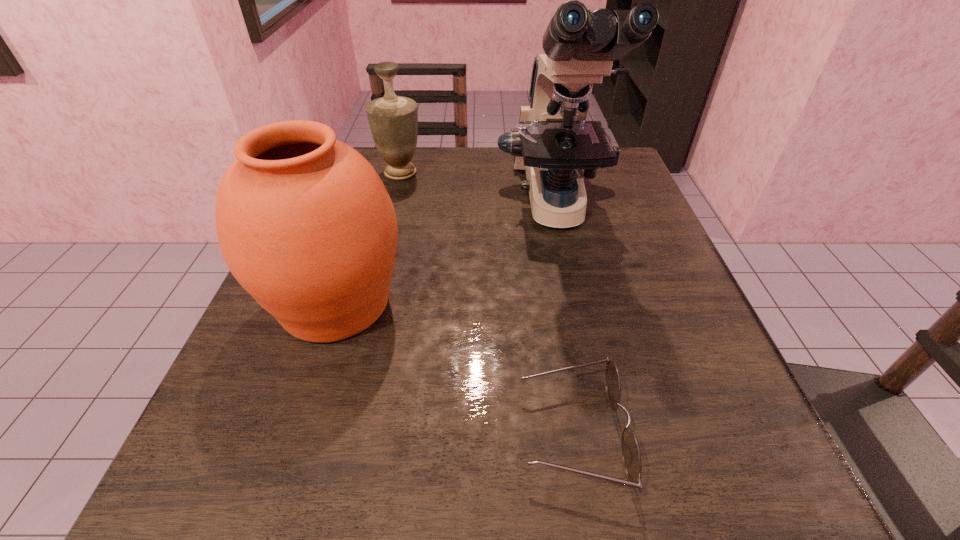
At what (x,y) coordinates should I click in order to perform the action: click on free spot between the shortest object and the farther urn. Please return your answer as a coordinate pair (x, y). The height and width of the screenshot is (540, 960). Looking at the image, I should click on (487, 302).

Where is `free space between the microscope and the second tallest object`? This screenshot has height=540, width=960. free space between the microscope and the second tallest object is located at coordinates (445, 255).

Identify the location of free spot between the microscope and the nearer urn. This screenshot has width=960, height=540. (445, 255).

Locate an element on the screen. unoccupied position between the microscope and the shortest object is located at coordinates (564, 320).

The image size is (960, 540). I want to click on empty location between the spectacles and the taller urn, so click(x=454, y=367).

Point out which object is positioned as the second nearest to the shorter urn. Please provide its 2D coordinates. Your answer should be formatted as a tuple, i.e. [(x, y)], where the tuple contains the x and y coordinates of a point satisfying the conditions above.

[(305, 224)]

The width and height of the screenshot is (960, 540). In order to click on object that is the third closest one to the nearest object in this screenshot , I will do tap(393, 120).